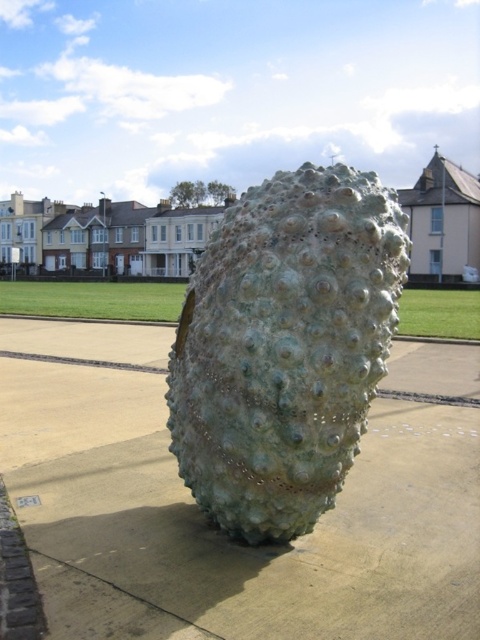
Who is higher up, greenish concrete at center or green textured sculpture at center?

green textured sculpture at center is above.

Can you confirm if greenish concrete at center is bigger than green textured sculpture at center?

Yes, greenish concrete at center is bigger than green textured sculpture at center.

Is point (479, 612) closer to viewer compared to point (342, 392)?

Yes, point (479, 612) is closer to viewer.

In order to click on greenish concrete at center in this screenshot , I will do `click(204, 516)`.